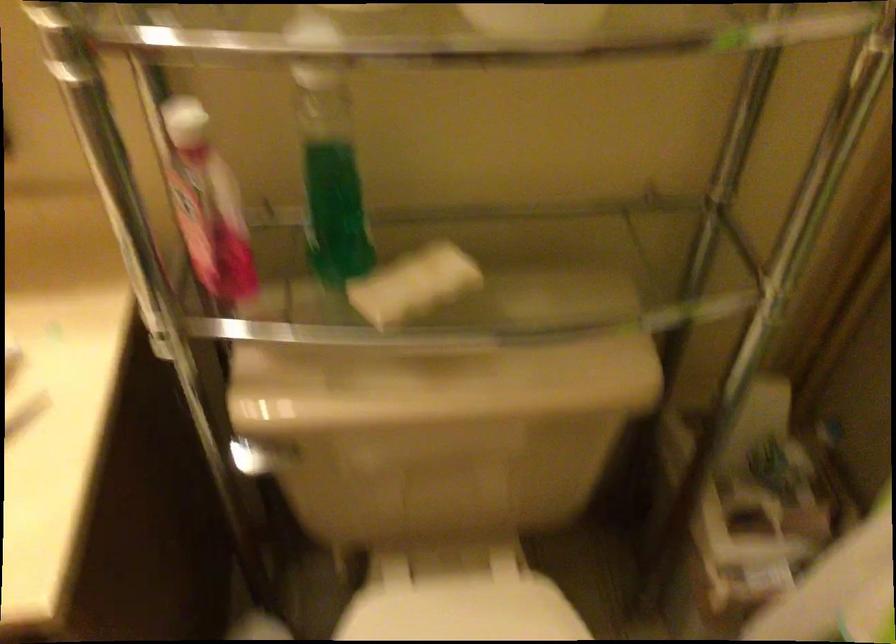
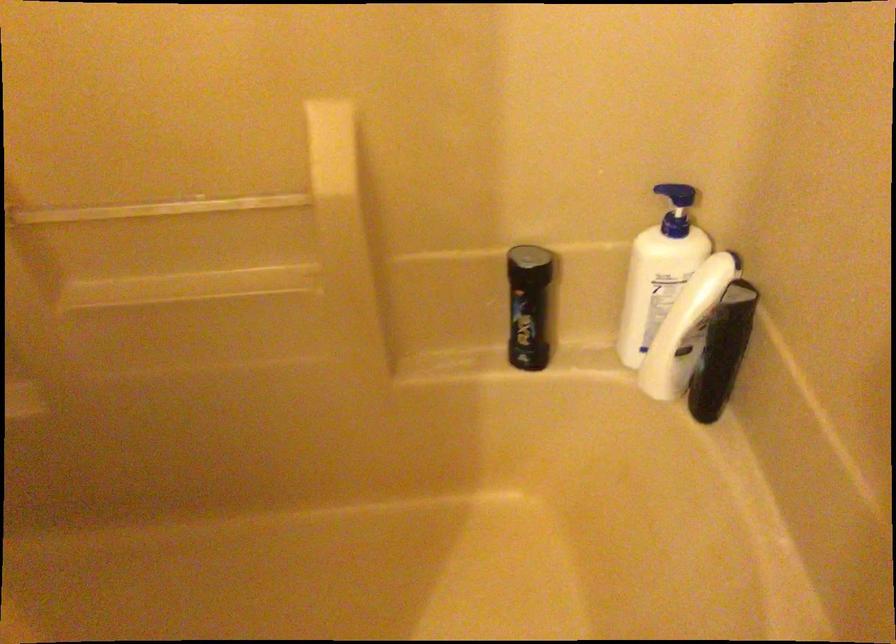
The images are taken continuously from a first-person perspective. In which direction is your viewpoint rotating?

The rotation direction of the camera is right-down.